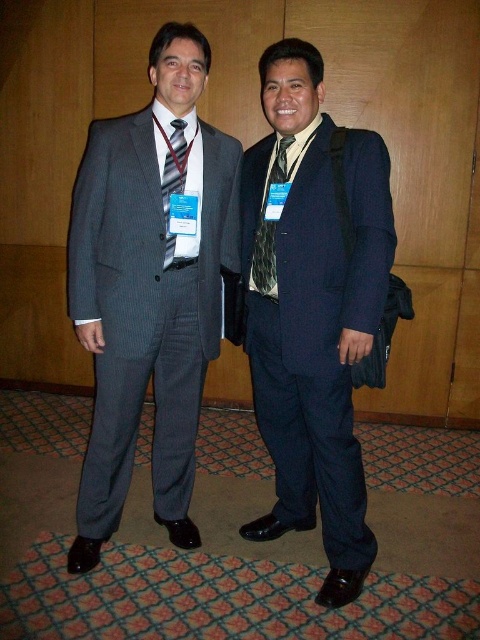
You are a photographer standing in front of the two men at the event. You need to capture a closeup shot of the patterned silk tie at center. Considering your current distance, can you get a clear closeup without moving closer than 6 feet?

The patterned silk tie at center and viewer are 6.04 feet apart. Since the required distance is over 6 feet, you can capture a clear closeup without moving closer than 6 feet.

In the scene shown: You are standing at the point marked by the coordinates point (348, 182) in the image. A conference organizer asks you to move to a position exactly 3 feet away from your current location towards the nearest exit. Can you reach that position without moving past the two men in the scene?

The distance between point (348, 182) and the viewer is 5.79 feet. Moving 3 feet towards the nearest exit from point (348, 182) would leave you 2.79 feet away from your original position, but without knowing the exact path or the positions of the two men, it is impossible to determine if you can reach the desired position without moving past them.

What are the coordinates of the patterned silk tie at center in the image?

The patterned silk tie at center is located at coordinates point (268, 225).